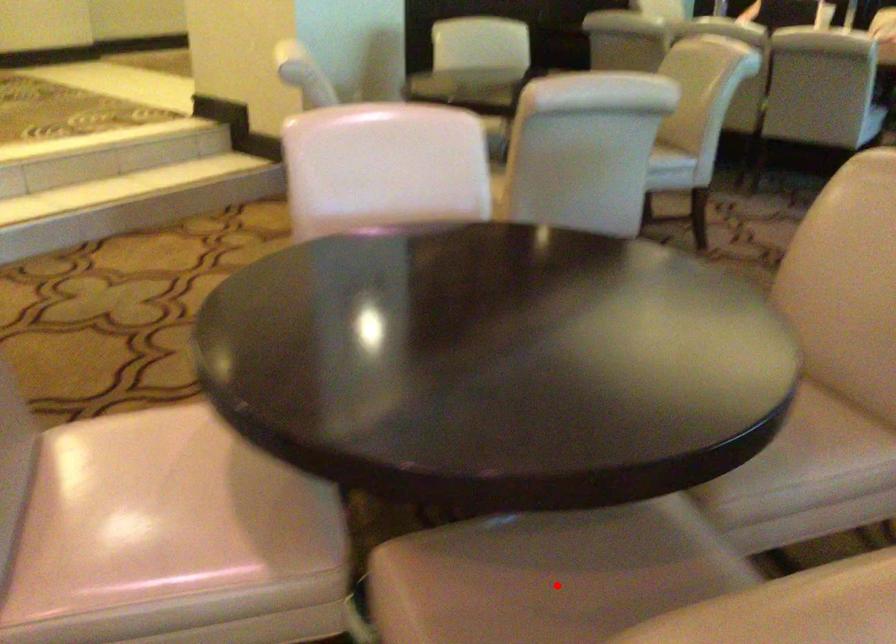
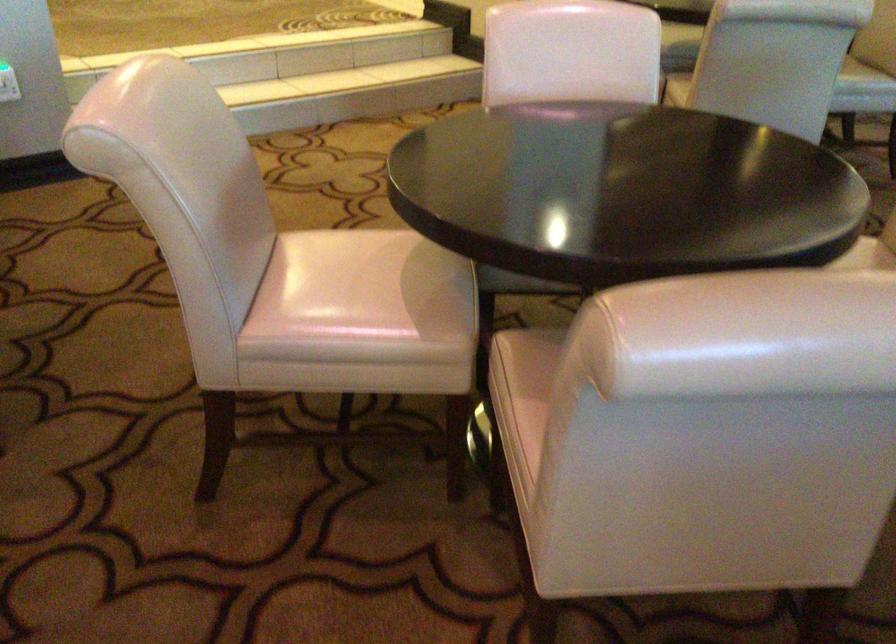
Question: I am providing you with two images of the same scene from different viewpoints. A red point is marked on the first image. At the location where the point appears in image 1, is it still visible in image 2?

Choices:
 (A) Yes
 (B) No

Answer: (B)